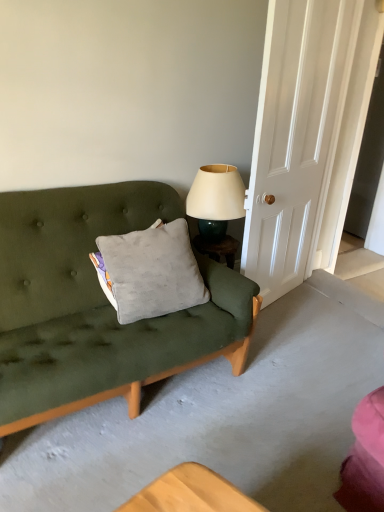
Question: From a real-world perspective, is matte cream lampshade at upper right located higher than gray velvety pillow at center?

Choices:
 (A) no
 (B) yes

Answer: (B)

Question: Can you confirm if matte cream lampshade at upper right is smaller than gray velvety pillow at center?

Choices:
 (A) no
 (B) yes

Answer: (B)

Question: Is matte cream lampshade at upper right looking in the opposite direction of gray velvety pillow at center?

Choices:
 (A) no
 (B) yes

Answer: (A)

Question: Can we say matte cream lampshade at upper right lies outside gray velvety pillow at center?

Choices:
 (A) yes
 (B) no

Answer: (A)

Question: Is the surface of matte cream lampshade at upper right in direct contact with gray velvety pillow at center?

Choices:
 (A) yes
 (B) no

Answer: (B)

Question: In the image, is matte cream lampshade at upper right positioned in front of or behind gray velvety pillow at center?

Choices:
 (A) behind
 (B) front

Answer: (A)

Question: In the image, is matte cream lampshade at upper right on the left side or the right side of gray velvety pillow at center?

Choices:
 (A) right
 (B) left

Answer: (A)

Question: Based on their sizes in the image, would you say matte cream lampshade at upper right is bigger or smaller than gray velvety pillow at center?

Choices:
 (A) small
 (B) big

Answer: (A)

Question: Is matte cream lampshade at upper right wider or thinner than gray velvety pillow at center?

Choices:
 (A) thin
 (B) wide

Answer: (B)

Question: From a real-world perspective, is gray velvety pillow at center physically located above or below white wood door at right?

Choices:
 (A) above
 (B) below

Answer: (B)

Question: Considering their positions, is gray velvety pillow at center located in front of or behind white wood door at right?

Choices:
 (A) behind
 (B) front

Answer: (B)

Question: Is point (173, 259) positioned closer to the camera than point (266, 162)?

Choices:
 (A) closer
 (B) farther

Answer: (A)

Question: Is gray velvety pillow at center wider or thinner than white wood door at right?

Choices:
 (A) thin
 (B) wide

Answer: (B)

Question: Is point (188, 267) closer or farther from the camera than point (193, 214)?

Choices:
 (A) closer
 (B) farther

Answer: (A)

Question: From a real-world perspective, is gray velvety pillow at center physically located above or below matte cream lampshade at upper right?

Choices:
 (A) above
 (B) below

Answer: (B)